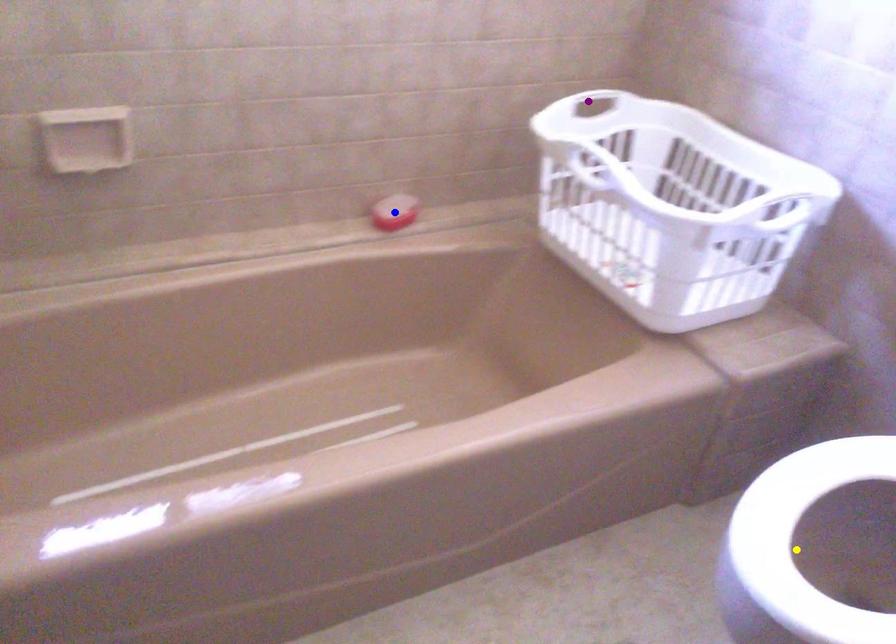
Order these from farthest to nearest:
yellow point | blue point | purple point

purple point < blue point < yellow point